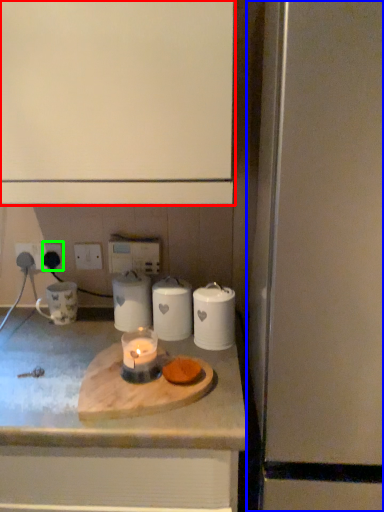
Question: Estimate the real-world distances between objects in this image. Which object is farther from cabinetry (highlighted by a red box), appliance (highlighted by a blue box) or electric outlet (highlighted by a green box)?

Choices:
 (A) appliance
 (B) electric outlet

Answer: (B)